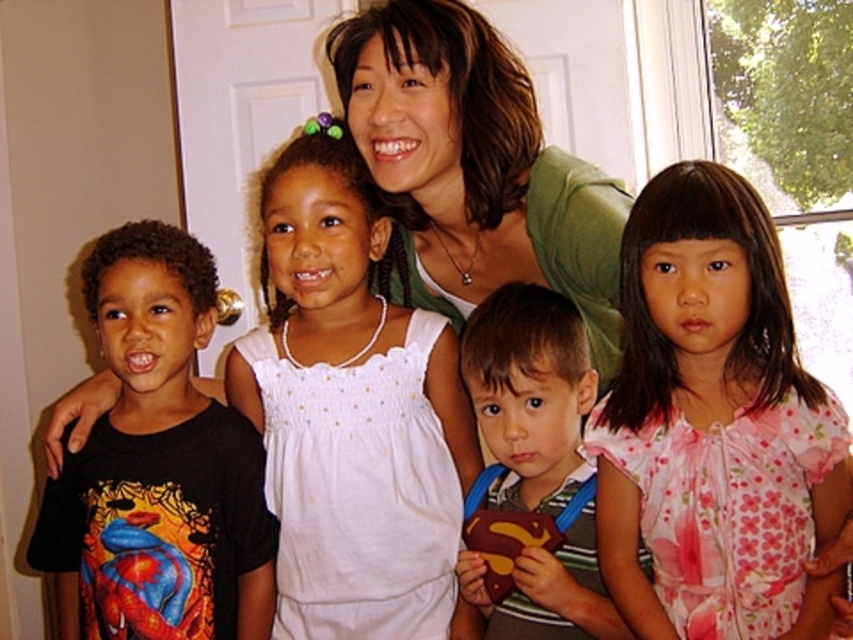
From the picture: You are a tailor who needs to determine which garment requires more fabric for alterations. Based on the image, which item has a larger width between the pink floral blouse at center and the green fabric shirt at center?

The green fabric shirt at center has a larger width than the pink floral blouse at center, so it would require more fabric for alterations.

You are a photographer setting up for a family portrait. You notice the pink floral blouse at center and the green fabric shirt at center. Which one is closer to the camera?

The pink floral blouse at center is in front of the green fabric shirt at center, so it is closer to the camera.

You are a photographer standing 5 feet away from the camera. You want to take a photo of the green fabric shirt at center. Can you reach it with your hand to adjust it without moving closer?

The green fabric shirt at center is 4.98 feet away from the camera. Since you are standing 5 feet away from the camera, you are 0.02 feet farther than the shirt. You can slightly extend your hand to reach it without needing to move closer.